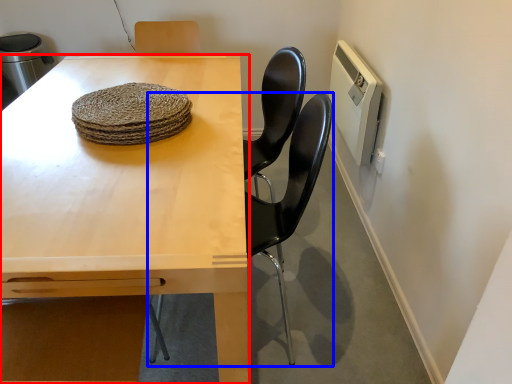
Question: Among these objects, which one is nearest to the camera, table (highlighted by a red box) or chair (highlighted by a blue box)?

Choices:
 (A) table
 (B) chair

Answer: (A)